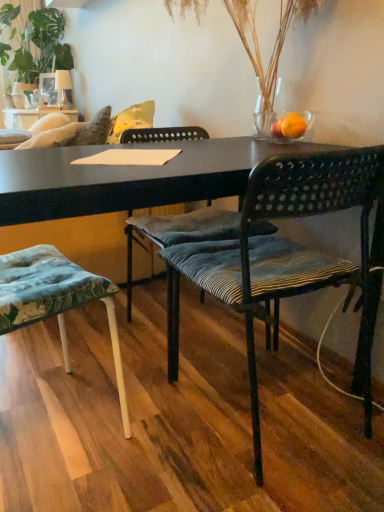
Question: Based on their sizes in the image, would you say green leafy plant at upper left is bigger or smaller than black woven chair at center, the 1th chair when ordered from right to left?

Choices:
 (A) small
 (B) big

Answer: (B)

Question: Do you think green leafy plant at upper left is within black woven chair at center, the 1th chair when ordered from right to left, or outside of it?

Choices:
 (A) outside
 (B) inside

Answer: (A)

Question: Estimate the real-world distances between objects in this image. Which object is closer to the green leafy plant at upper left?

Choices:
 (A) transparent glass bowl at upper right
 (B) textured fabric cushion at lower left, which is the 1th chair from left to right
 (C) velvet green cushion at center
 (D) black woven chair at center, acting as the 3th chair starting from the left
 (E) clear glass vase at upper center

Answer: (C)

Question: Considering the real-world distances, which object is closest to the orange matte glass at upper right?

Choices:
 (A) black woven chair at center, acting as the 3th chair starting from the left
 (B) transparent glass bowl at upper right
 (C) velvet green cushion at center
 (D) clear glass vase at upper center
 (E) green leafy plant at upper left

Answer: (B)